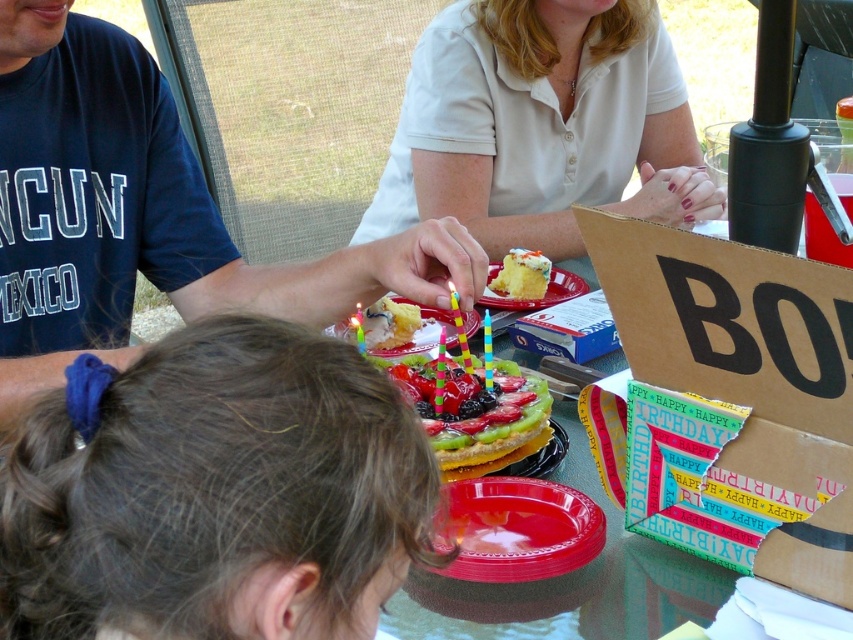
You are a photographer at the birthday party. You need to take a photo of the multicolored plastic birthday candle at center without the blue cotton shirt at center blocking it. How should you adjust your camera angle?

The blue cotton shirt at center is located above the multicolored plastic birthday candle at center. To avoid the shirt blocking the candle, you should lower your camera angle slightly so that the candle is visible below the shirt.

You are standing at the center of the room and want to hand a gift to the person wearing the blue cotton shirt at center. In which direction should you move to reach them?

The blue cotton shirt at center is located at point (178, 225), so you should move towards the center of the room to reach them.